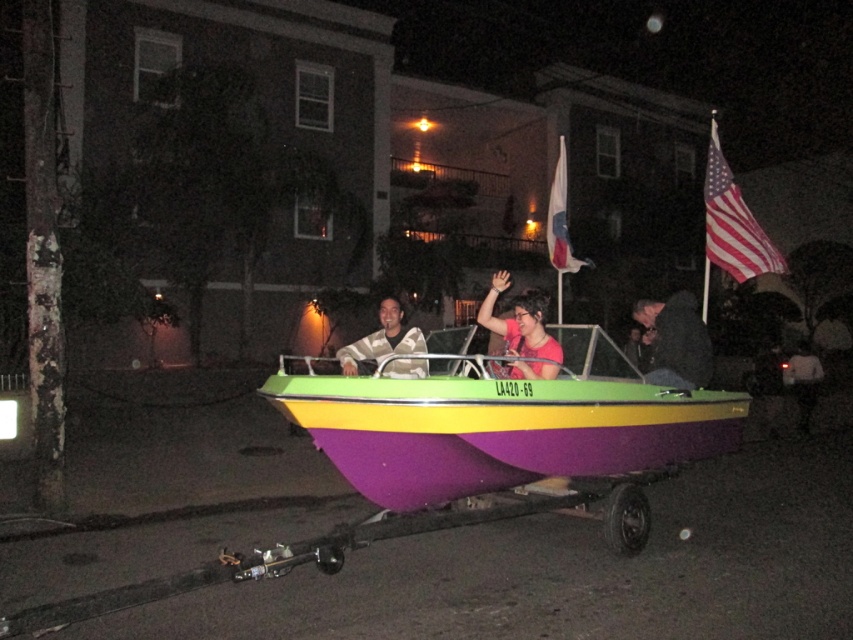
Question: Which of the following is the farthest from the observer?

Choices:
 (A) coord(532,349)
 (B) coord(641,412)

Answer: (A)

Question: Can you confirm if american flag at upper right is wider than matte pink shirt at center?

Choices:
 (A) yes
 (B) no

Answer: (A)

Question: Is dark gray fabric jacket at center positioned in front of white fabric flag at upper center?

Choices:
 (A) yes
 (B) no

Answer: (A)

Question: Among these objects, which one is farthest from the camera?

Choices:
 (A) matte purple boat at center
 (B) dark gray fabric jacket at center
 (C) camouflage fabric shirt at center

Answer: (B)

Question: Is matte pink shirt at center positioned before camouflage fabric shirt at center?

Choices:
 (A) yes
 (B) no

Answer: (B)

Question: Estimate the real-world distances between objects in this image. Which object is closer to the american flag at upper right?

Choices:
 (A) dark gray fabric jacket at center
 (B) white fabric flag at upper center
 (C) matte purple boat at center
 (D) matte pink shirt at center

Answer: (A)